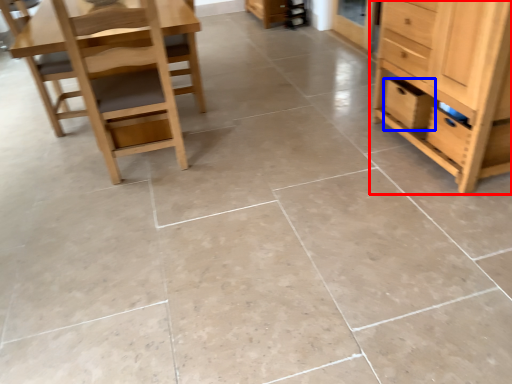
Question: Which object appears farthest to the camera in this image, chest of drawers (highlighted by a red box) or drawer (highlighted by a blue box)?

Choices:
 (A) chest of drawers
 (B) drawer

Answer: (B)